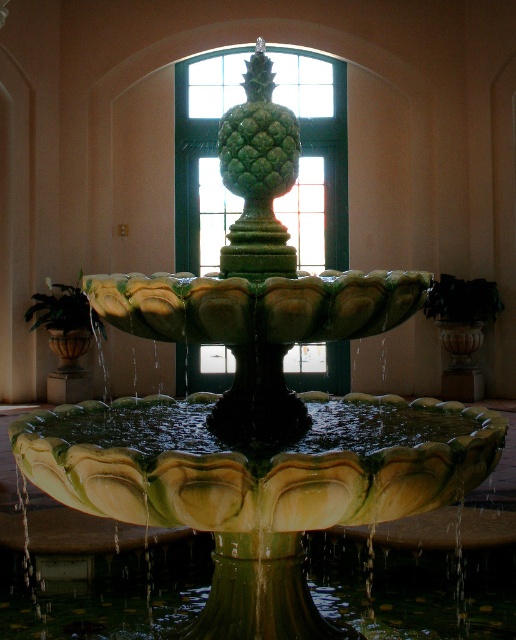
How much distance is there between green glass window at center and green matte pineapple at center?

green glass window at center and green matte pineapple at center are 34.04 feet apart.

Is green glass window at center thinner than green matte pineapple at center?

Incorrect, green glass window at center's width is not less than green matte pineapple at center's.

Is point (321, 257) more distant than point (263, 131)?

Yes, point (321, 257) is behind point (263, 131).

At what (x,y) coordinates should I click in order to perform the action: click on green glass window at center. Please return your answer as a coordinate pair (x, y). Looking at the image, I should click on (316, 157).